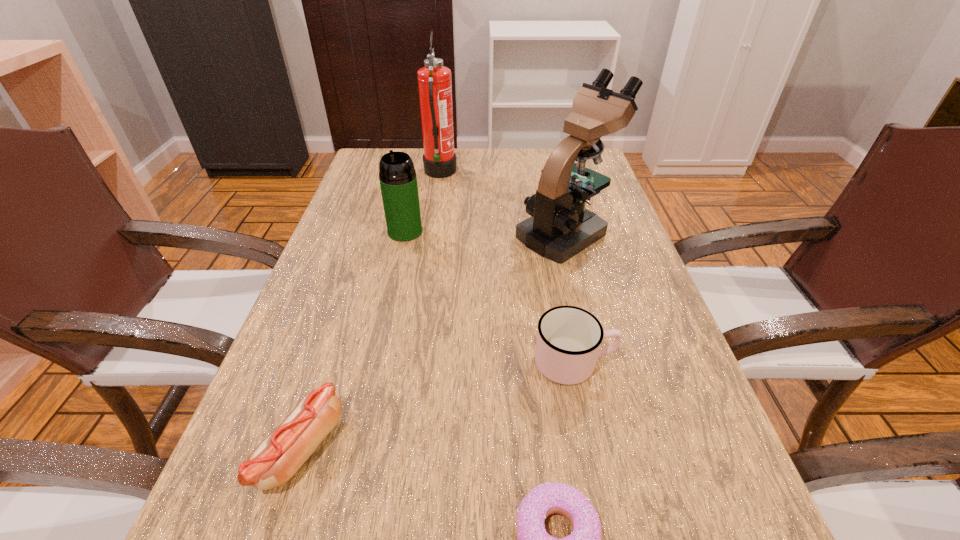
Locate an element on the screen. This screenshot has width=960, height=540. free region located 0.400m on the right of the fifth tallest object is located at coordinates (604, 450).

Where is `object that is at the far edge`? object that is at the far edge is located at coordinates (434, 80).

Locate an element on the screen. thermos bottle located in the left edge section of the desktop is located at coordinates (398, 181).

This screenshot has height=540, width=960. Identify the location of sausage that is positioned at the left edge. (278, 457).

At what (x,y) coordinates should I click in order to perform the action: click on microscope located in the right edge section of the desktop. Please return your answer as a coordinate pair (x, y). The width and height of the screenshot is (960, 540). Looking at the image, I should click on (560, 227).

Find the location of a particular element. The width and height of the screenshot is (960, 540). mug that is positioned at the right edge is located at coordinates (568, 341).

Locate an element on the screen. blank space at the left edge of the desktop is located at coordinates (336, 310).

This screenshot has width=960, height=540. I want to click on vacant space at the right edge of the desktop, so click(602, 310).

In the image, there is a desktop. Where is `free space at the far left corner`? free space at the far left corner is located at coordinates (380, 150).

At what (x,y) coordinates should I click in order to perform the action: click on empty space between the second shortest object and the third shortest object. Please return your answer as a coordinate pair (x, y). Image resolution: width=960 pixels, height=540 pixels. Looking at the image, I should click on (438, 406).